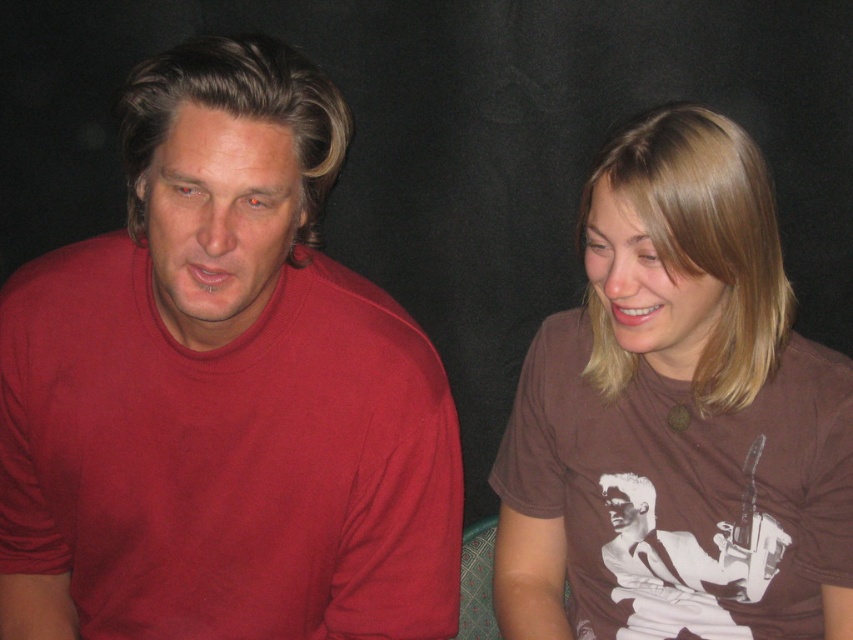
Question: Which of the following is the closest to the observer?

Choices:
 (A) (593, 488)
 (B) (213, 342)

Answer: (B)

Question: From the image, what is the correct spatial relationship of matte red t-shirt at left in relation to brown cotton t-shirt at right?

Choices:
 (A) left
 (B) right

Answer: (A)

Question: From the image, what is the correct spatial relationship of matte red t-shirt at left in relation to brown cotton t-shirt at right?

Choices:
 (A) above
 (B) below

Answer: (A)

Question: Can you confirm if matte red t-shirt at left is smaller than brown cotton t-shirt at right?

Choices:
 (A) no
 (B) yes

Answer: (A)

Question: Which object is farther from the camera taking this photo?

Choices:
 (A) brown cotton t-shirt at right
 (B) matte red t-shirt at left

Answer: (A)